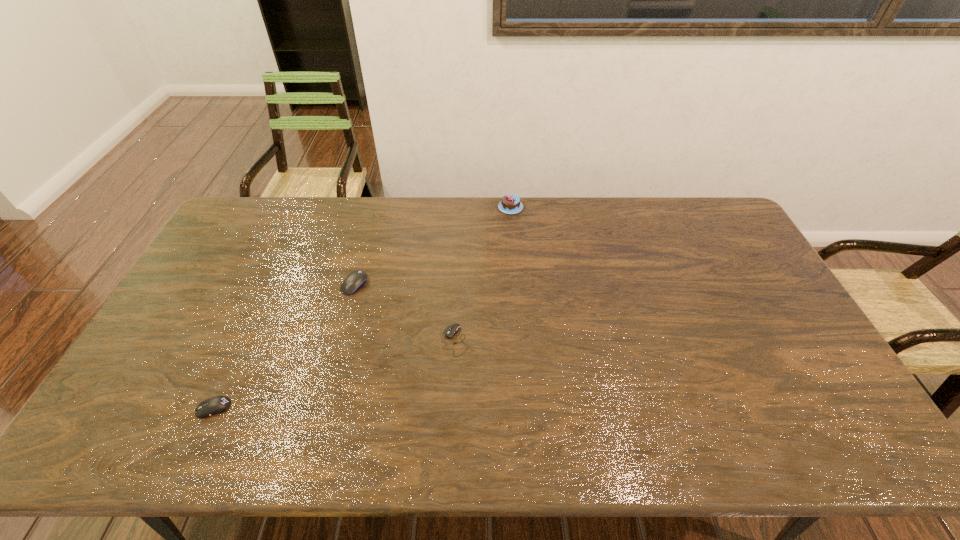
Where is `computer mouse that is the nearest to the shortest computer mouse`? computer mouse that is the nearest to the shortest computer mouse is located at coordinates (355, 280).

Find the location of `vacant space that satisfies the following two spatial constraints: 1. on the back side of the nearest computer mouse; 2. on the right side of the chocolate cake`. vacant space that satisfies the following two spatial constraints: 1. on the back side of the nearest computer mouse; 2. on the right side of the chocolate cake is located at coordinates (304, 207).

Where is `free space that satisfies the following two spatial constraints: 1. on the back side of the second tallest object; 2. on the right side of the second shortest computer mouse`? free space that satisfies the following two spatial constraints: 1. on the back side of the second tallest object; 2. on the right side of the second shortest computer mouse is located at coordinates (270, 285).